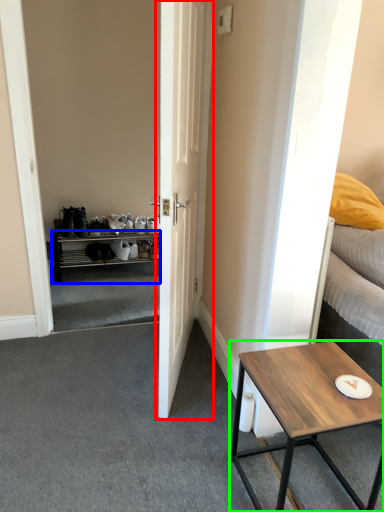
Question: Based on their relative distances, which object is nearer to door (highlighted by a red box)? Choose from cabinetry (highlighted by a blue box) and coffee table (highlighted by a green box).

Choices:
 (A) cabinetry
 (B) coffee table

Answer: (B)